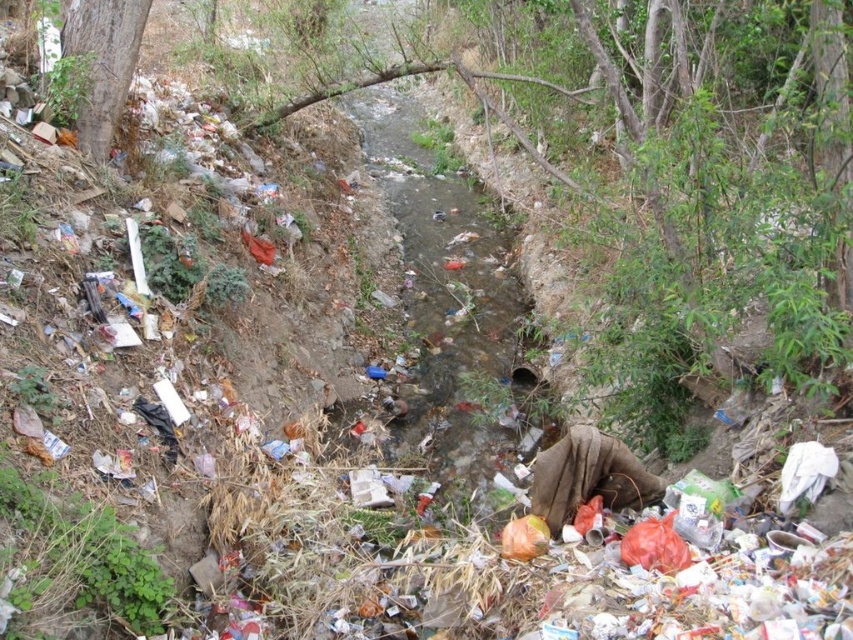
You are standing 3 meters away from the brown rough tree at center. Can you see the camera?

The brown rough tree at center and camera are 3.36 meters apart. Since you are 3 meters away from the tree, the distance between you and the camera is 0.36 meters, so yes, you can see the camera.

You are a hiker who wants to cross the polluted stream. You see a brown rough tree at center and a smooth brown tree trunk at upper left. Which tree can you use as a bridge to cross the stream?

The brown rough tree at center has a larger size compared to smooth brown tree trunk at upper left, so it can support your weight and is suitable to use as a bridge to cross the stream.

You are standing at the point with coordinates (624, 170) in the polluted waterway scene. What object are you standing on?

The point at coordinates (624, 170) corresponds to the brown rough tree at center, so you are standing on the brown rough tree at center.